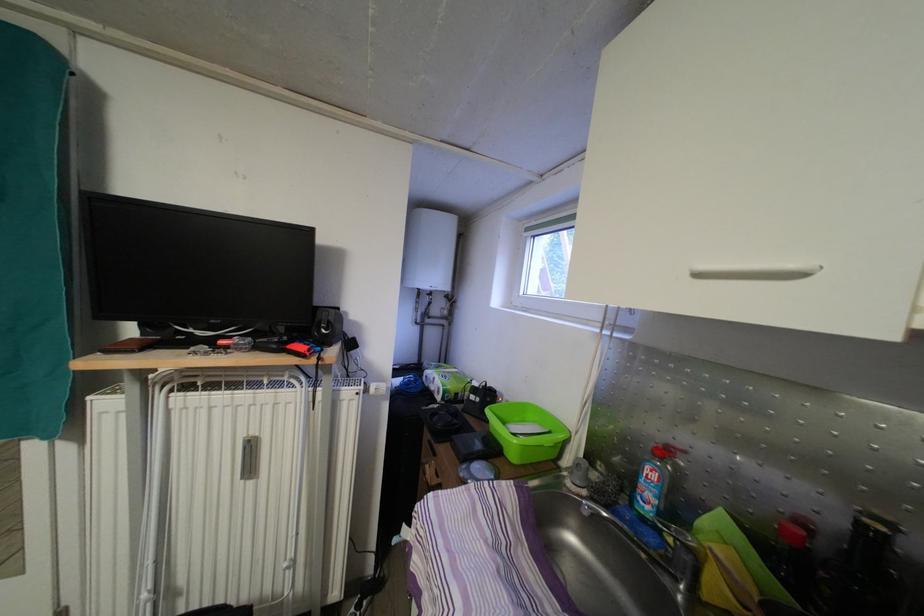
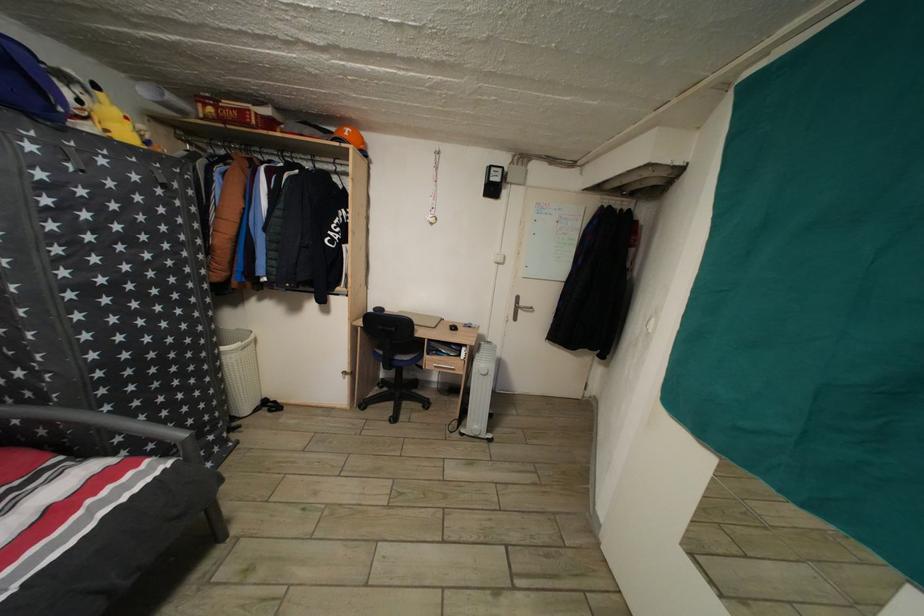
Question: The images are taken continuously from a first-person perspective. In which direction is your viewpoint rotating?

Choices:
 (A) Left
 (B) Right
 (C) Up
 (D) Down

Answer: (A)